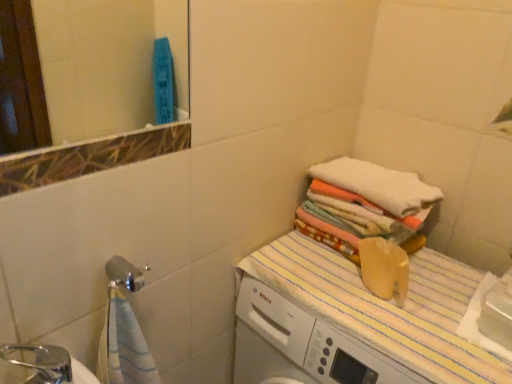
What do you see at coordinates (378, 185) in the screenshot? I see `white soft towel at upper right` at bounding box center [378, 185].

At what (x,y) coordinates should I click in order to perform the action: click on white soft towel at upper right. Please return your answer as a coordinate pair (x, y). The width and height of the screenshot is (512, 384). Looking at the image, I should click on (378, 185).

Where is `white soft towel at upper right`? The image size is (512, 384). white soft towel at upper right is located at coordinates (378, 185).